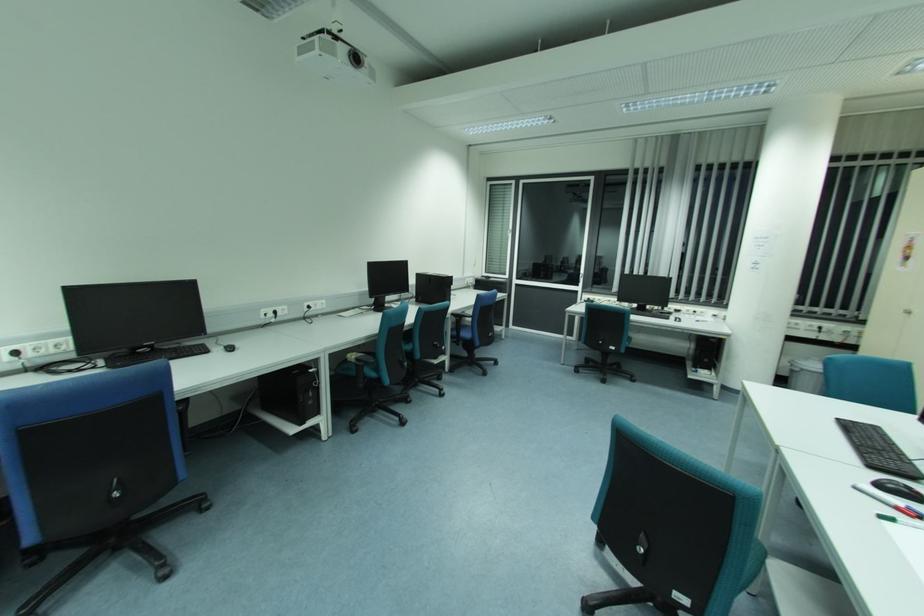
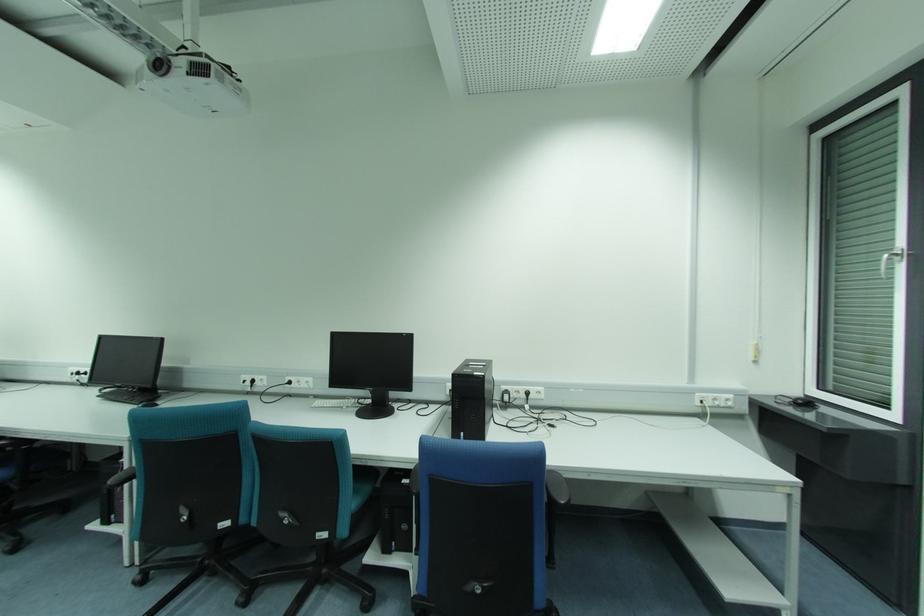
The point at (489, 278) is marked in the first image. Where is the corresponding point in the second image?

(808, 403)